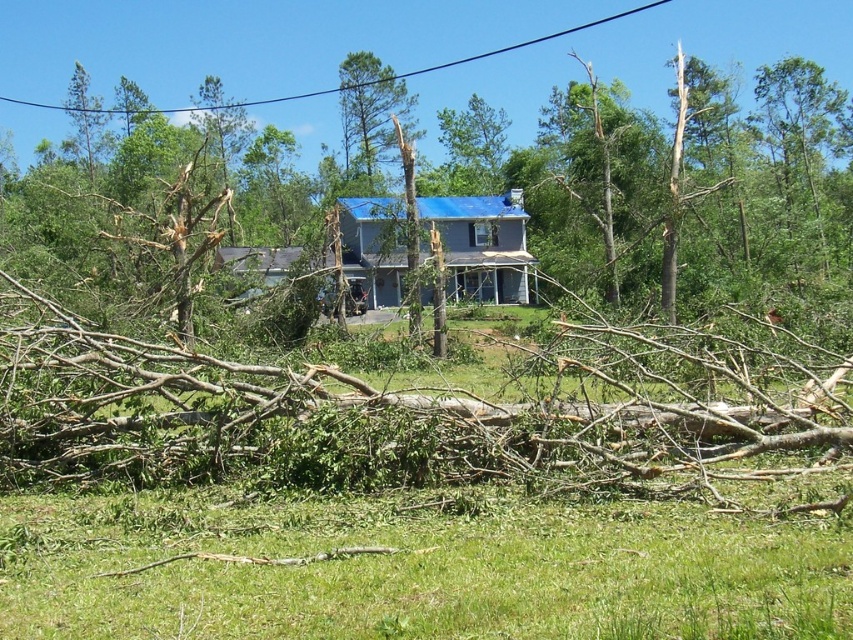
Question: Is brown wood tree at center above green rough bark tree at center?

Choices:
 (A) yes
 (B) no

Answer: (B)

Question: Can you confirm if brown wood tree at center is positioned to the right of black wire at upper center?

Choices:
 (A) no
 (B) yes

Answer: (B)

Question: Can you confirm if green rough bark tree at center is positioned above black wire at upper center?

Choices:
 (A) yes
 (B) no

Answer: (B)

Question: Based on their relative distances, which object is nearer to the green rough bark tree at center?

Choices:
 (A) black wire at upper center
 (B) brown wood tree at center

Answer: (A)

Question: Which point is closer to the camera?

Choices:
 (A) brown wood tree at center
 (B) green rough bark tree at center
 (C) black wire at upper center

Answer: (A)

Question: Which object is positioned closest to the brown wood tree at center?

Choices:
 (A) green rough bark tree at center
 (B) black wire at upper center

Answer: (A)